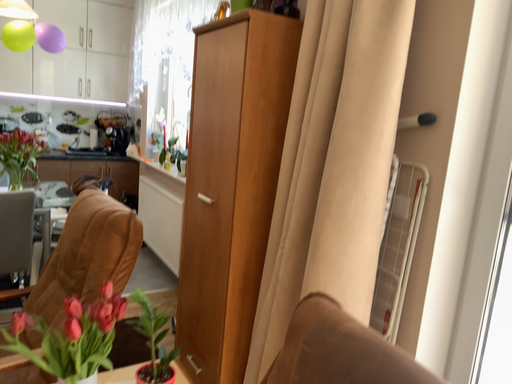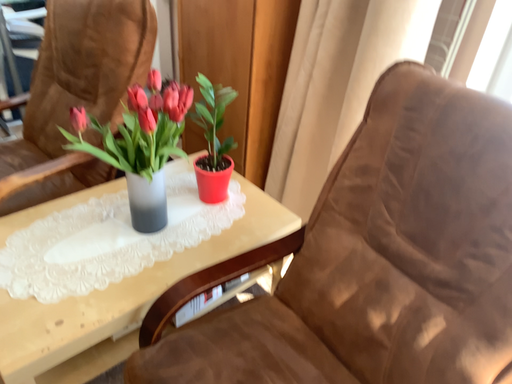
Question: How did the camera likely rotate when shooting the video?

Choices:
 (A) rotated upward
 (B) rotated downward

Answer: (B)